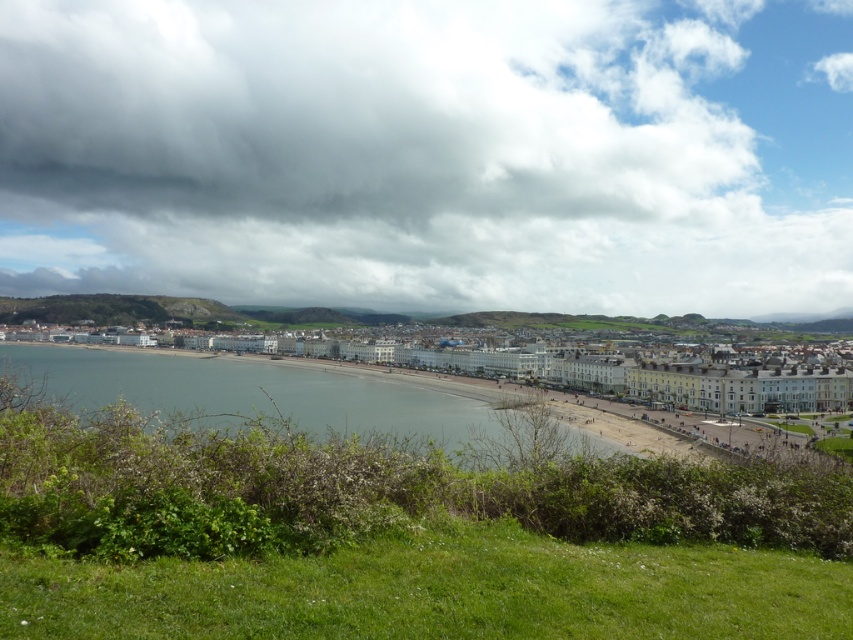
Where is `cloudy sky at upper center`? cloudy sky at upper center is located at coordinates (431, 154).

Which is in front, point (189, 184) or point (737, 403)?

Point (737, 403) is more forward.

The image size is (853, 640). What are the coordinates of `cloudy sky at upper center` in the screenshot? It's located at (431, 154).

Image resolution: width=853 pixels, height=640 pixels. I want to click on cloudy sky at upper center, so click(431, 154).

Which is more to the right, blue water at lower center or white smooth buildings at center?

white smooth buildings at center is more to the right.

Between point (167, 371) and point (805, 403), which one is positioned in front?

Point (805, 403) is more forward.

Identify the location of blue water at lower center. The image size is (853, 640). (270, 394).

Between cloudy sky at upper center and blue water at lower center, which one has more height?

cloudy sky at upper center is taller.

Does cloudy sky at upper center appear over blue water at lower center?

Yes.

Describe the element at coordinates (431, 154) in the screenshot. Image resolution: width=853 pixels, height=640 pixels. I see `cloudy sky at upper center` at that location.

The image size is (853, 640). What are the coordinates of `cloudy sky at upper center` in the screenshot? It's located at (431, 154).